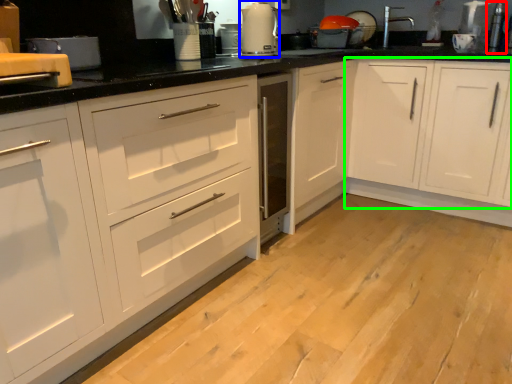
Question: Based on their relative distances, which object is nearer to appliance (highlighted by a red box)? Choose from kitchen appliance (highlighted by a blue box) and cabinetry (highlighted by a green box).

Choices:
 (A) kitchen appliance
 (B) cabinetry

Answer: (B)